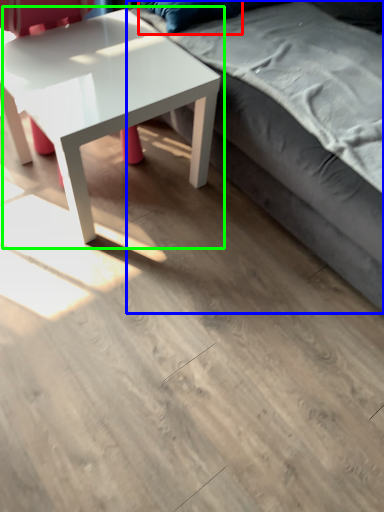
Question: Based on their relative distances, which object is farther from pillow (highlighted by a red box)? Choose from studio couch (highlighted by a blue box) and coffee table (highlighted by a green box).

Choices:
 (A) studio couch
 (B) coffee table

Answer: (A)